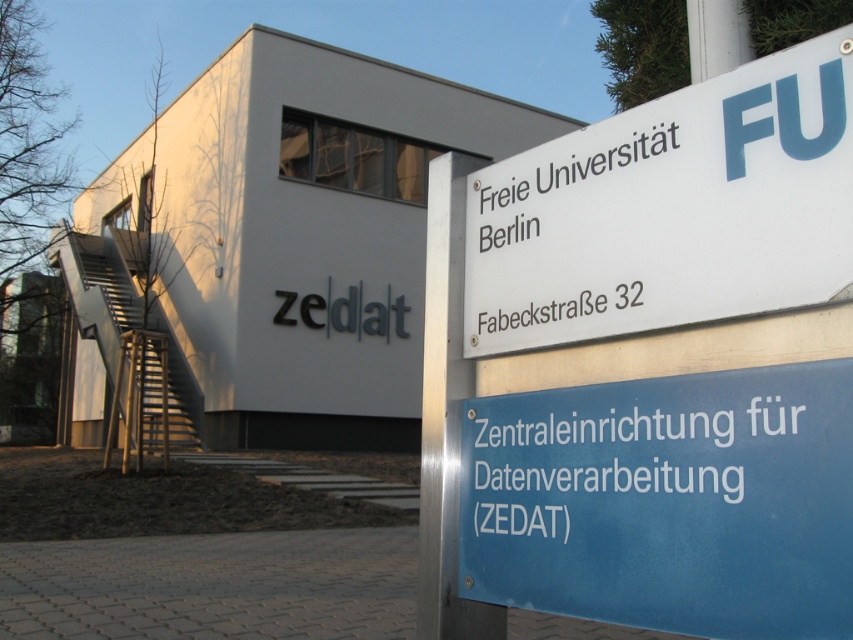
Question: Does blue glossy sign at center appear on the left side of white plastic sign at upper right?

Choices:
 (A) no
 (B) yes

Answer: (B)

Question: Which object appears farthest from the camera in this image?

Choices:
 (A) blue glossy sign at center
 (B) white plastic sign at upper right

Answer: (B)

Question: Can you confirm if blue glossy sign at center is positioned to the left of white plastic sign at upper right?

Choices:
 (A) yes
 (B) no

Answer: (A)

Question: Does blue glossy sign at center lie in front of white plastic sign at upper right?

Choices:
 (A) yes
 (B) no

Answer: (A)

Question: Which object appears farthest from the camera in this image?

Choices:
 (A) white plastic sign at upper right
 (B) blue glossy sign at center

Answer: (A)

Question: Among these objects, which one is nearest to the camera?

Choices:
 (A) blue glossy sign at center
 (B) white plastic sign at upper right

Answer: (A)